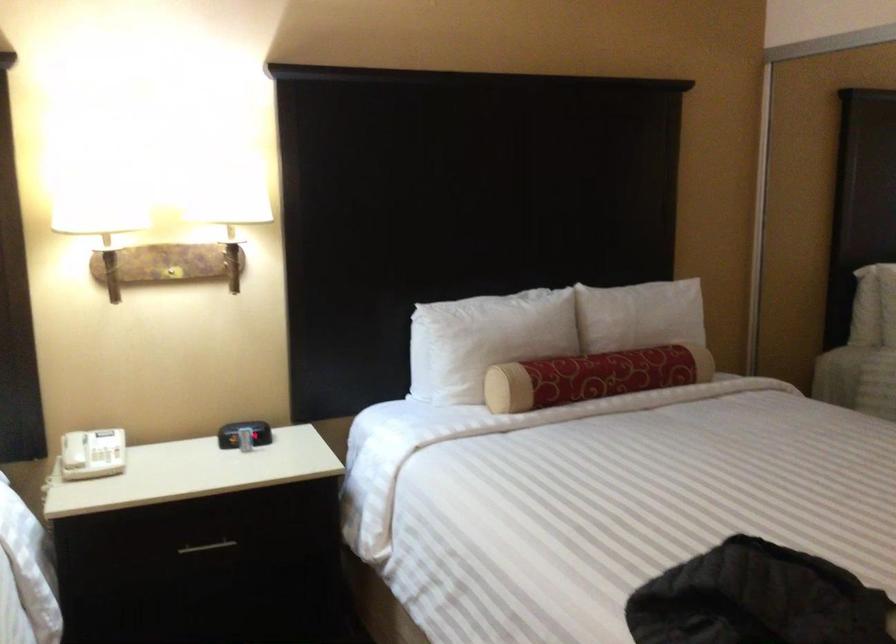
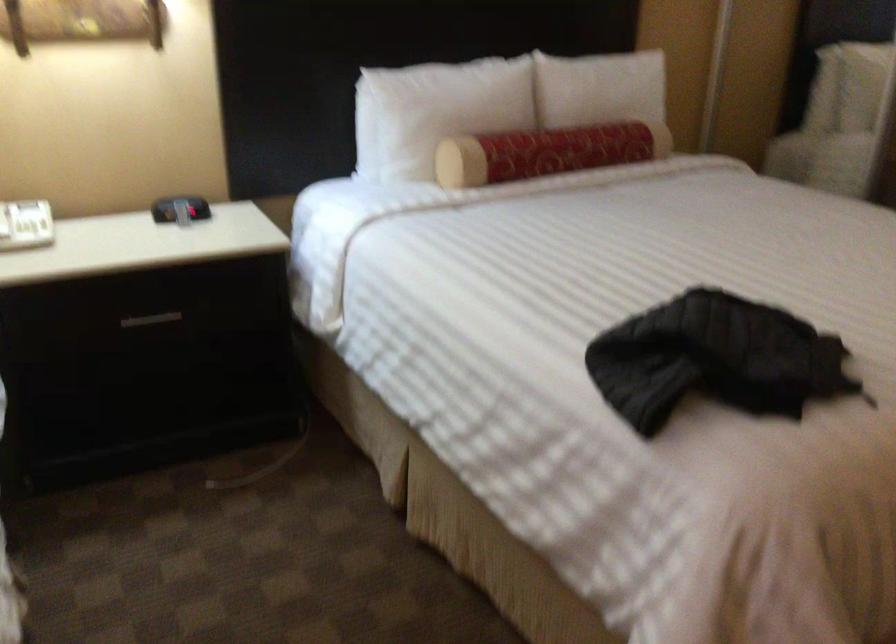
The point at (x=480, y=341) is marked in the first image. Where is the corresponding point in the second image?

(435, 111)